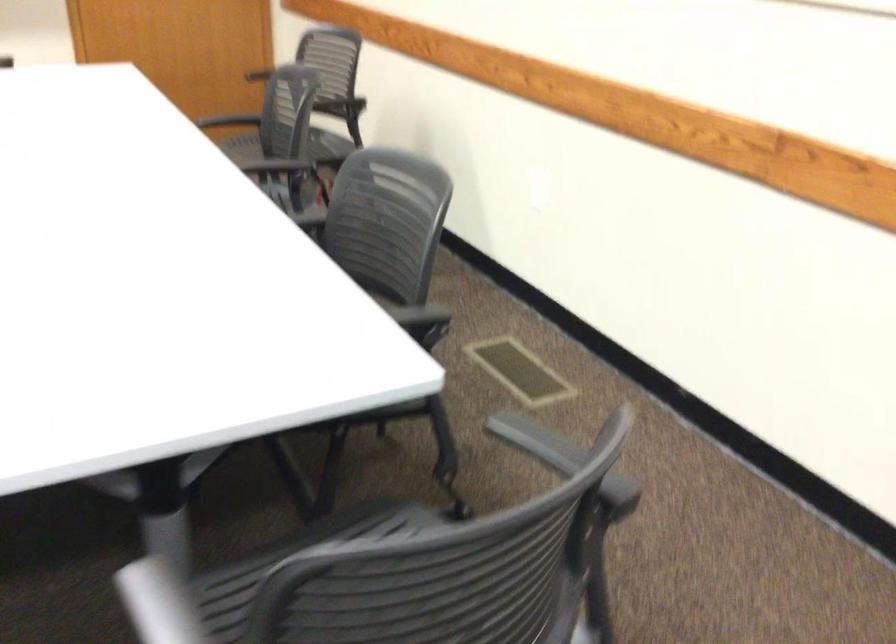
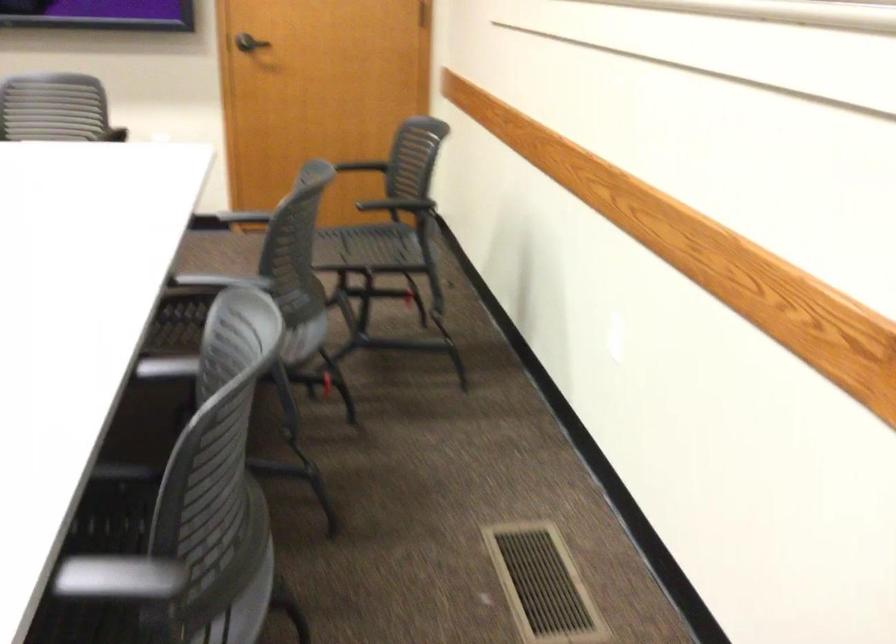
The point at (338, 102) is marked in the first image. Where is the corresponding point in the second image?

(398, 205)